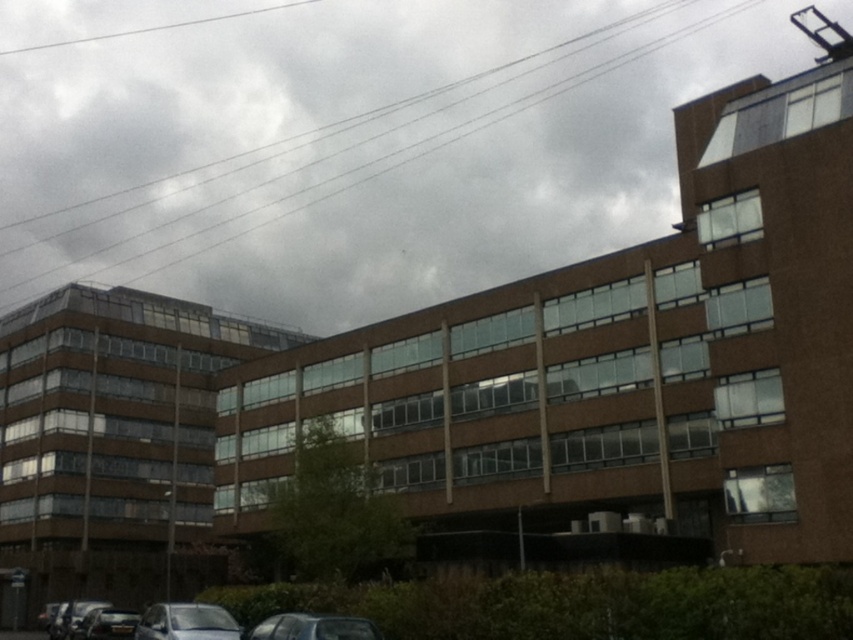
You are standing at the entrance of the multi story building and want to find the metallic silver car at lower left. Based on the coordinates provided, in which direction should you look to locate it?

The metallic silver car at lower left is located at point (186, 621), which means it is positioned towards the lower left direction from your current position at the entrance.

You are standing in front of the multi story building with modern architecture. You see a point at coordinate (312,627). What object is located at that point?

The point at coordinate (312,627) corresponds to the metallic silver car at lower center.